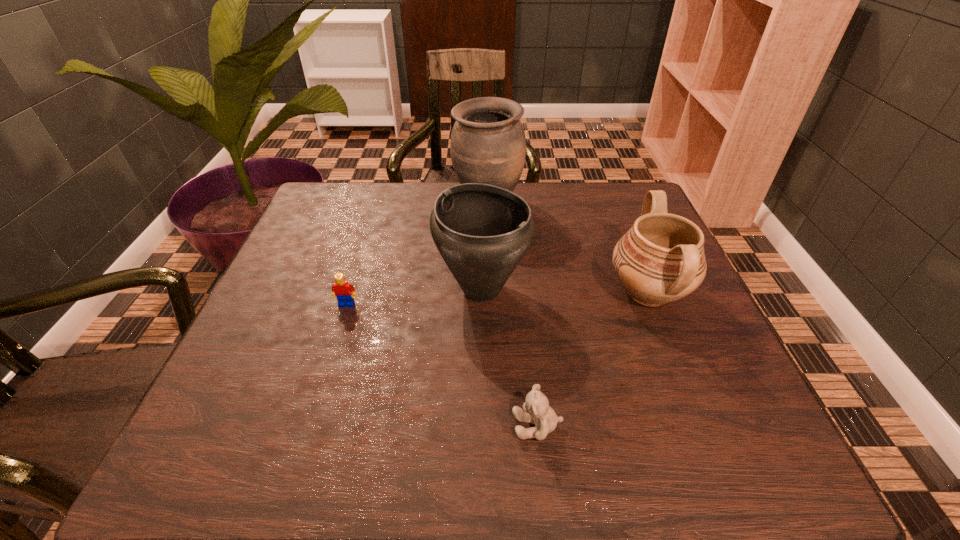
Identify which urn is the second closest to the rightmost urn. Please provide its 2D coordinates. Your answer should be formatted as a tuple, i.e. [(x, y)], where the tuple contains the x and y coordinates of a point satisfying the conditions above.

[(488, 145)]

This screenshot has width=960, height=540. Find the location of `urn that is the second closest one to the rightmost object`. urn that is the second closest one to the rightmost object is located at coordinates (488, 145).

What are the coordinates of `vacant space that satisfies the following two spatial constraints: 1. on the front-facing side of the rightmost object; 2. on the front-facing side of the leftmost object` in the screenshot? It's located at (653, 305).